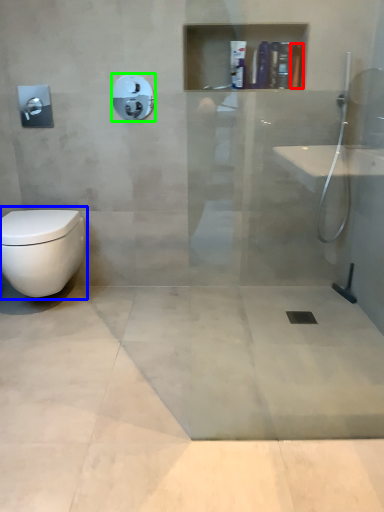
Question: Which object is positioned farthest from toiletry (highlighted by a red box)? Select from toilet (highlighted by a blue box) and shower (highlighted by a green box).

Choices:
 (A) toilet
 (B) shower

Answer: (A)